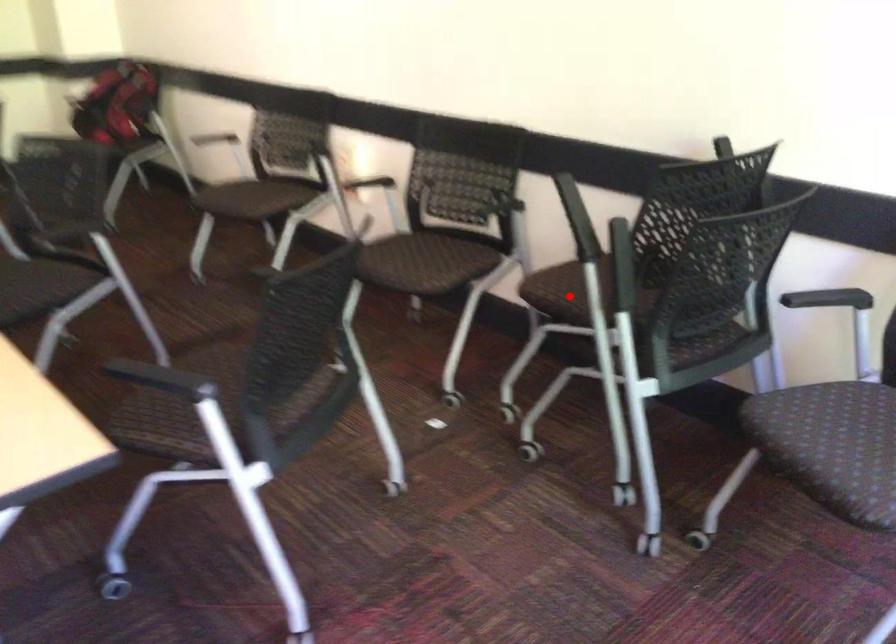
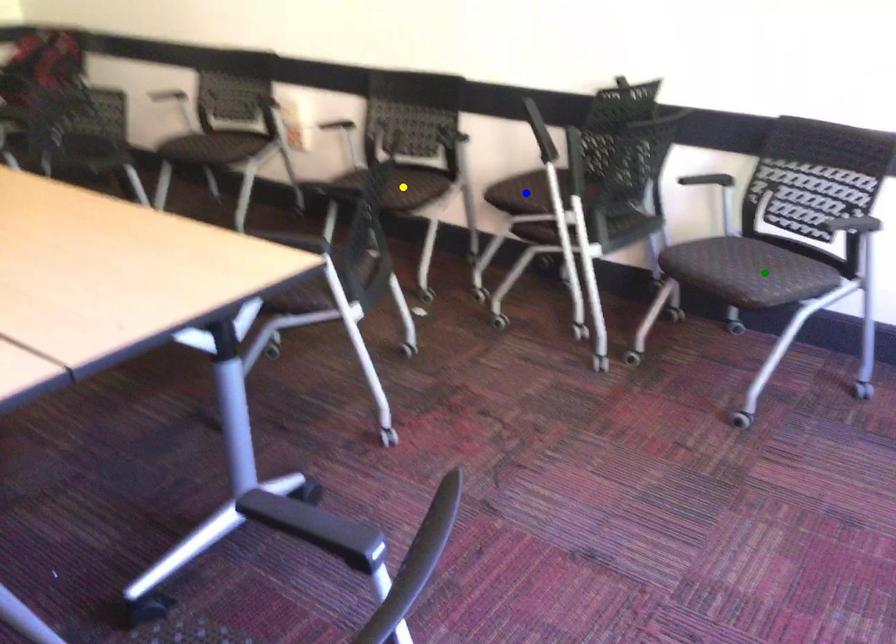
Question: I am providing you with two images of the same scene from different viewpoints. A red point is marked on the first image. You are given multiple points on the second image. Which mark in image 2 goes with the point in image 1?

Choices:
 (A) blue point
 (B) green point
 (C) yellow point

Answer: (A)